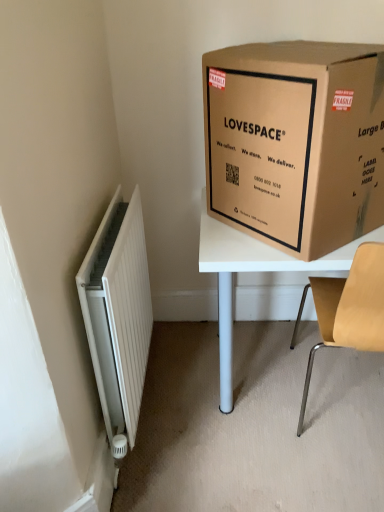
Question: Would you say light brown wood chair at right is to the left or to the right of white ribbed radiator at left in the picture?

Choices:
 (A) left
 (B) right

Answer: (B)

Question: In terms of width, does light brown wood chair at right look wider or thinner when compared to white ribbed radiator at left?

Choices:
 (A) wide
 (B) thin

Answer: (A)

Question: Estimate the real-world distances between objects in this image. Which object is closer to the light brown wood chair at right?

Choices:
 (A) white ribbed radiator at left
 (B) brown cardboard box at upper right

Answer: (B)

Question: Based on their relative distances, which object is nearer to the white ribbed radiator at left?

Choices:
 (A) brown cardboard box at upper right
 (B) light brown wood chair at right

Answer: (A)